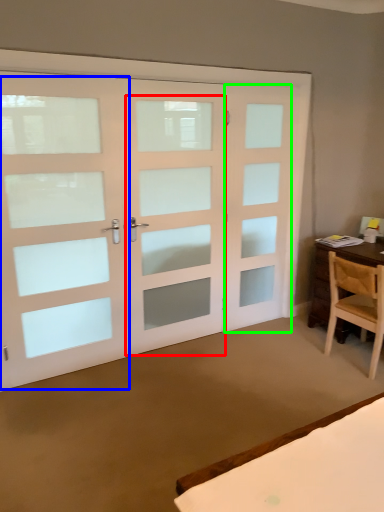
Question: Which is farther away from screen door (highlighted by a red box)? screen door (highlighted by a blue box) or screen door (highlighted by a green box)?

Choices:
 (A) screen door
 (B) screen door

Answer: (A)